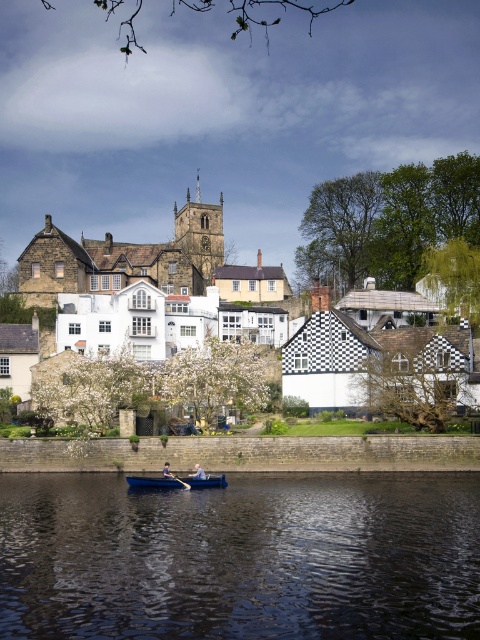
Question: Can you confirm if dark blue water at lower center is wider than wooden canoe at center?

Choices:
 (A) no
 (B) yes

Answer: (B)

Question: From the image, what is the correct spatial relationship of dark blue fabric rower at center in relation to wooden paddle at center?

Choices:
 (A) below
 (B) above

Answer: (B)

Question: Which of these objects is positioned farthest from the dark blue fabric rower at center?

Choices:
 (A) dark blue water at lower center
 (B) wooden canoe at center

Answer: (A)

Question: Among these objects, which one is nearest to the camera?

Choices:
 (A) dark blue water at lower center
 (B) dark blue fabric rower at center
 (C) wooden paddle at center
 (D) wooden canoe at center

Answer: (A)

Question: Is blue fabric boat at lower center further to the viewer compared to dark blue fabric rower at center?

Choices:
 (A) yes
 (B) no

Answer: (A)

Question: Which object is farther from the camera taking this photo?

Choices:
 (A) dark blue water at lower center
 (B) dark blue fabric rower at center

Answer: (B)